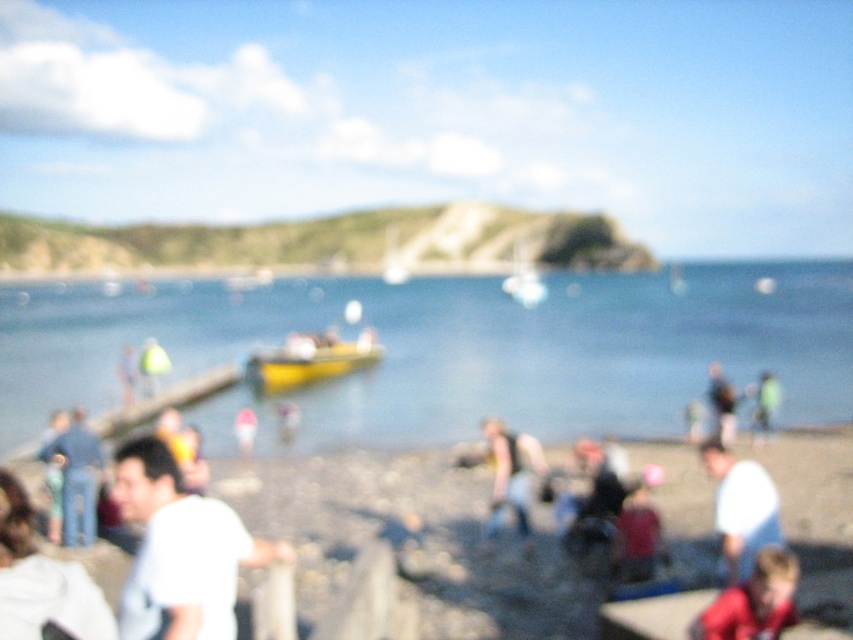
Question: Is blue water at center positioned before light blue shirt at center?

Choices:
 (A) yes
 (B) no

Answer: (A)

Question: Which of the following is the farthest from the observer?

Choices:
 (A) light brown leather jacket at center
 (B) smooth sand at lower center
 (C) dark brown leather jacket at center
 (D) blue water at center

Answer: (D)

Question: Is denim jeans at lower left above neon yellow jacket at center?

Choices:
 (A) yes
 (B) no

Answer: (B)

Question: Which of the following is the closest to the observer?

Choices:
 (A) (505, 460)
 (B) (74, 524)
 (C) (360, 342)

Answer: (B)

Question: Estimate the real-world distances between objects in this image. Which object is closer to the denim jeans at lower left?

Choices:
 (A) light blue shirt at center
 (B) neon yellow jacket at center
 (C) smooth sand at lower center
 (D) dark brown leather jacket at center

Answer: (D)

Question: Is smooth sand at lower center to the left of white matte shirt at lower left from the viewer's perspective?

Choices:
 (A) no
 (B) yes

Answer: (A)